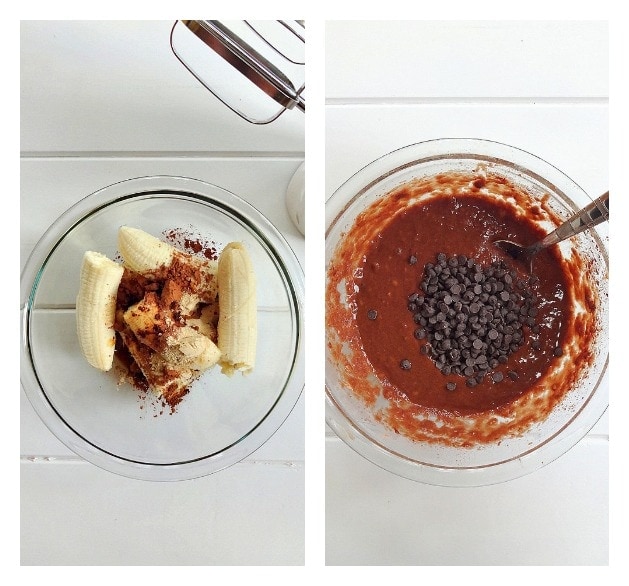
Find the location of a particular element. This screenshot has width=629, height=586. spoon is located at coordinates (569, 227).